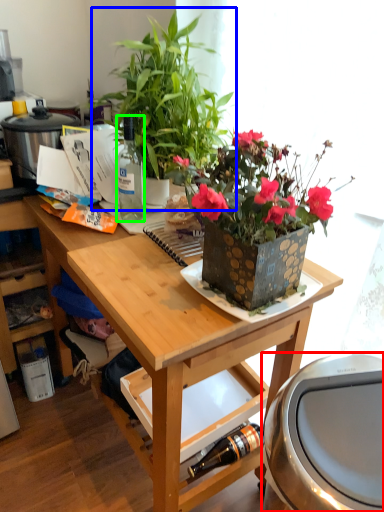
Question: Based on their relative distances, which object is farther from appliance (highlighted by a red box)? Choose from houseplant (highlighted by a blue box) and bottle (highlighted by a green box).

Choices:
 (A) houseplant
 (B) bottle

Answer: (B)